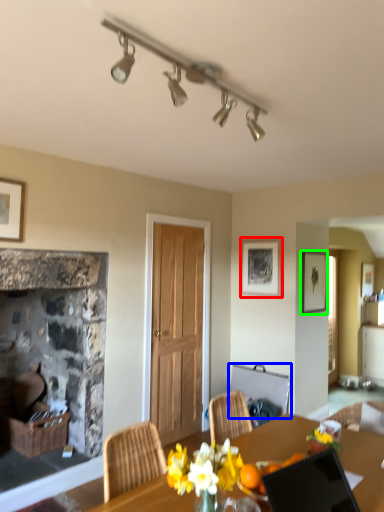
Question: Estimate the real-world distances between objects in this image. Which object is closer to picture frame (highlighted by a red box), chair (highlighted by a blue box) or picture frame (highlighted by a green box)?

Choices:
 (A) chair
 (B) picture frame

Answer: (B)